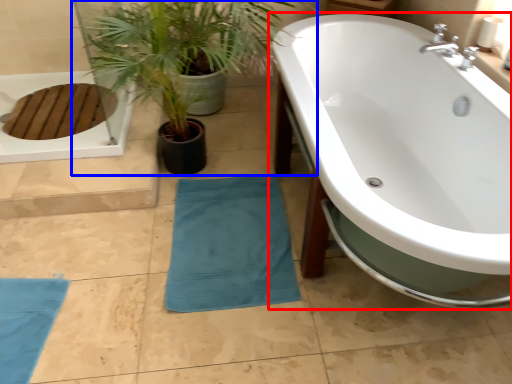
Question: Which object appears farthest to the camera in this image, bathtub (highlighted by a red box) or houseplant (highlighted by a blue box)?

Choices:
 (A) bathtub
 (B) houseplant

Answer: (B)